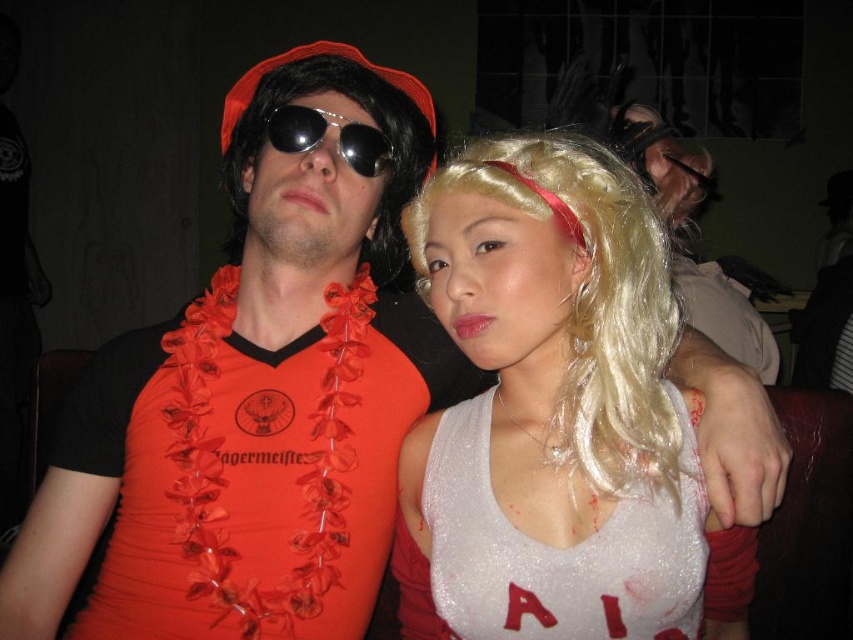
Is orange fabric lei at left thinner than metallic aviator sunglasses at center?

No, orange fabric lei at left is not thinner than metallic aviator sunglasses at center.

Locate an element on the screen. This screenshot has height=640, width=853. orange fabric lei at left is located at coordinates [247, 468].

This screenshot has width=853, height=640. In order to click on orange fabric lei at left in this screenshot , I will do `click(247, 468)`.

Is point (572, 186) behind point (691, 173)?

No, it is in front of (691, 173).

At what (x,y) coordinates should I click in order to perform the action: click on shiny white tank top at center. Please return your answer as a coordinate pair (x, y). This screenshot has height=640, width=853. Looking at the image, I should click on (556, 413).

I want to click on shiny white tank top at center, so click(556, 413).

Looking at this image, is shiny white tank top at center to the left of metallic aviator sunglasses at center from the viewer's perspective?

In fact, shiny white tank top at center is to the right of metallic aviator sunglasses at center.

You are a GUI agent. You are given a task and a screenshot of the screen. Output one action in this format:
    pyautogui.click(x=<x>, y=<y>)
    Task: Click on the shiny white tank top at center
    
    Given the screenshot: What is the action you would take?
    pyautogui.click(x=556, y=413)

Is point (450, 620) less distant than point (349, 124)?

Yes, it is.

This screenshot has height=640, width=853. I want to click on shiny white tank top at center, so click(556, 413).